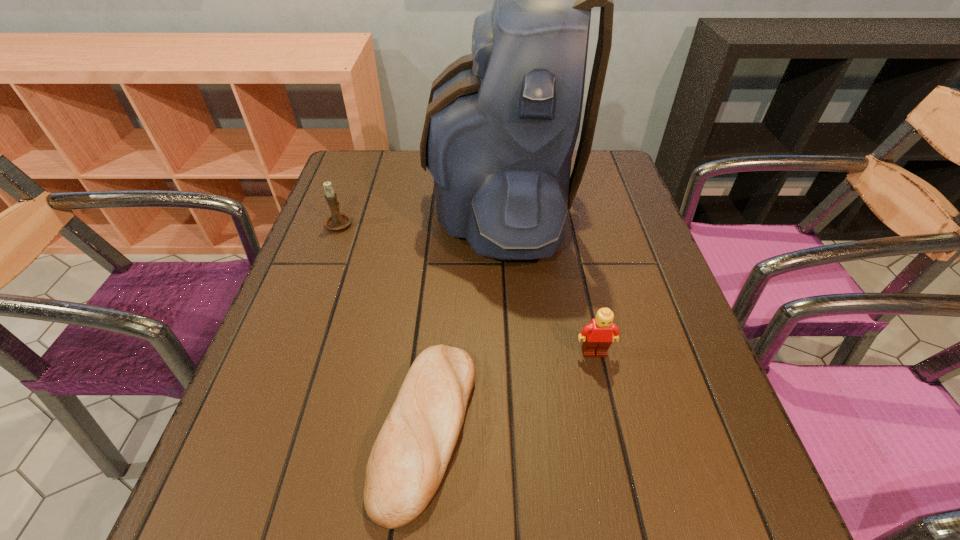
Where is `free space located 0.140m on the face of the Lego`? free space located 0.140m on the face of the Lego is located at coordinates pyautogui.click(x=612, y=432).

Locate an element on the screen. vacant region located on the right of the shortest object is located at coordinates (587, 429).

This screenshot has height=540, width=960. I want to click on object that is at the far edge, so click(501, 125).

Find the location of a particular element. The image size is (960, 540). object situated at the near edge is located at coordinates (408, 460).

The height and width of the screenshot is (540, 960). I want to click on object that is positioned at the left edge, so click(x=337, y=221).

This screenshot has width=960, height=540. What are the coordinates of `object located at the right edge` in the screenshot? It's located at (598, 335).

At what (x,y) coordinates should I click in order to perform the action: click on vacant space at the near edge of the desktop. Please return your answer as a coordinate pair (x, y). The height and width of the screenshot is (540, 960). Looking at the image, I should click on (382, 534).

The width and height of the screenshot is (960, 540). In the image, there is a desktop. In order to click on vacant region at the left edge in this screenshot , I will do `click(330, 291)`.

Where is `vacant space at the right edge of the desktop`? This screenshot has width=960, height=540. vacant space at the right edge of the desktop is located at coordinates (616, 233).

In the image, there is a desktop. At what (x,y) coordinates should I click in order to perform the action: click on blank space at the far left corner. Please return your answer as a coordinate pair (x, y). Image resolution: width=960 pixels, height=540 pixels. Looking at the image, I should click on (387, 169).